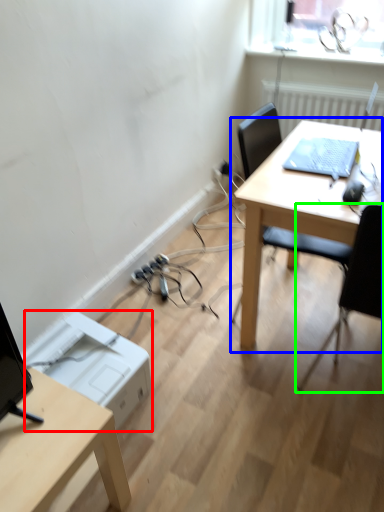
Question: Estimate the real-world distances between objects in this image. Which object is farther from printer (highlighted by a red box), table (highlighted by a blue box) or chair (highlighted by a green box)?

Choices:
 (A) table
 (B) chair

Answer: (B)